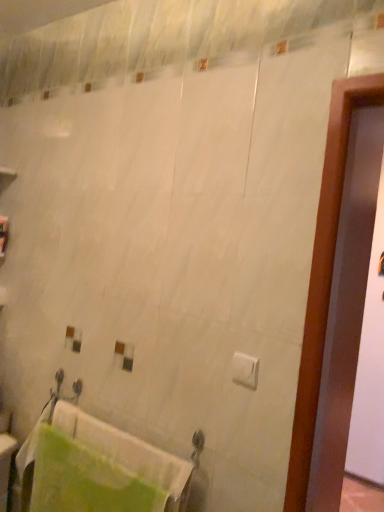
This screenshot has height=512, width=384. What do you see at coordinates (245, 370) in the screenshot? I see `white matte toilet paper at center` at bounding box center [245, 370].

The height and width of the screenshot is (512, 384). I want to click on white matte toilet paper at center, so click(x=245, y=370).

The image size is (384, 512). What do you see at coordinates (95, 467) in the screenshot?
I see `green fabric towel at lower left` at bounding box center [95, 467].

Where is `green fabric towel at lower left`? This screenshot has width=384, height=512. green fabric towel at lower left is located at coordinates (95, 467).

Identify the location of white matte toilet paper at center. (245, 370).

Considering the positions of objects green fabric towel at lower left and white matte toilet paper at center in the image provided, who is more to the right, green fabric towel at lower left or white matte toilet paper at center?

From the viewer's perspective, white matte toilet paper at center appears more on the right side.

Between green fabric towel at lower left and white matte toilet paper at center, which one is positioned behind?

green fabric towel at lower left is further from the camera.

Consider the image. Which point is more forward, (139, 482) or (241, 354)?

Point (241, 354)

From the image's perspective, is green fabric towel at lower left positioned above or below white matte toilet paper at center?

green fabric towel at lower left is situated lower than white matte toilet paper at center in the image.

From a real-world perspective, relative to white matte toilet paper at center, is green fabric towel at lower left vertically above or below?

In terms of real-world spatial position, green fabric towel at lower left is below white matte toilet paper at center.

Considering the relative sizes of green fabric towel at lower left and white matte toilet paper at center in the image provided, is green fabric towel at lower left thinner than white matte toilet paper at center?

No, green fabric towel at lower left is not thinner than white matte toilet paper at center.

Can you confirm if green fabric towel at lower left is shorter than white matte toilet paper at center?

No.

Which of these two, green fabric towel at lower left or white matte toilet paper at center, is bigger?

With larger size is green fabric towel at lower left.

Is green fabric towel at lower left spatially inside white matte toilet paper at center, or outside of it?

green fabric towel at lower left is located beyond the bounds of white matte toilet paper at center.

Is green fabric towel at lower left placed right next to white matte toilet paper at center?

green fabric towel at lower left and white matte toilet paper at center are clearly separated.

Is green fabric towel at lower left turned away from white matte toilet paper at center?

That's not correct — green fabric towel at lower left is not looking away from white matte toilet paper at center.

How many degrees apart are the facing directions of green fabric towel at lower left and white matte toilet paper at center?

There is a 10.8-degree angle between the facing directions of green fabric towel at lower left and white matte toilet paper at center.

Where is `bath towel below the white matte toilet paper at center (from the image's perspective)`? The width and height of the screenshot is (384, 512). bath towel below the white matte toilet paper at center (from the image's perspective) is located at coordinates (95, 467).

Does white matte toilet paper at center appear on the right side of green fabric towel at lower left?

Yes, white matte toilet paper at center is to the right of green fabric towel at lower left.

Which object is further away from the camera taking this photo, white matte toilet paper at center or green fabric towel at lower left?

green fabric towel at lower left is further away from the camera.

Which is closer to the camera, (x=246, y=359) or (x=34, y=487)?

Point (x=246, y=359)

From the image's perspective, is white matte toilet paper at center over green fabric towel at lower left?

Yes, from the image's perspective, white matte toilet paper at center is on top of green fabric towel at lower left.

From a real-world perspective, is white matte toilet paper at center below green fabric towel at lower left?

No, from a real-world perspective, white matte toilet paper at center is not beneath green fabric towel at lower left.

Looking at their sizes, would you say white matte toilet paper at center is wider or thinner than green fabric towel at lower left?

white matte toilet paper at center is thinner than green fabric towel at lower left.

Considering the sizes of objects white matte toilet paper at center and green fabric towel at lower left in the image provided, who is taller, white matte toilet paper at center or green fabric towel at lower left?

Standing taller between the two is green fabric towel at lower left.

Is white matte toilet paper at center bigger or smaller than green fabric towel at lower left?

white matte toilet paper at center is smaller than green fabric towel at lower left.

Which is correct: white matte toilet paper at center is inside green fabric towel at lower left, or outside of it?

white matte toilet paper at center cannot be found inside green fabric towel at lower left.

Is the surface of white matte toilet paper at center in direct contact with green fabric towel at lower left?

white matte toilet paper at center is not next to green fabric towel at lower left, and they're not touching.

Is white matte toilet paper at center looking in the opposite direction of green fabric towel at lower left?

That's not correct — white matte toilet paper at center is not looking away from green fabric towel at lower left.

At what (x,y) coordinates should I click in order to perform the action: click on bath towel that appears below the white matte toilet paper at center (from the image's perspective). Please return your answer as a coordinate pair (x, y). Looking at the image, I should click on (95, 467).

Find the location of a particular element. The width and height of the screenshot is (384, 512). bath towel below the white matte toilet paper at center (from the image's perspective) is located at coordinates (95, 467).

Find the location of a particular element. The height and width of the screenshot is (512, 384). bath towel that is on the left side of white matte toilet paper at center is located at coordinates (x=95, y=467).